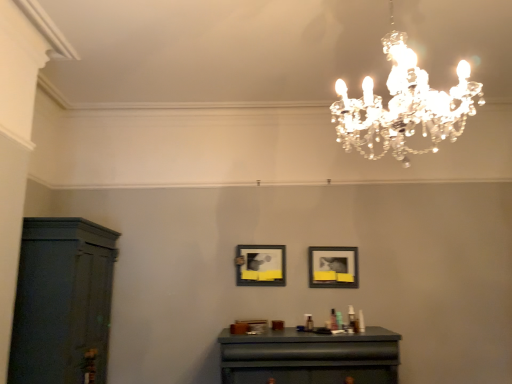
What do you see at coordinates (310, 357) in the screenshot? I see `matte black table at center` at bounding box center [310, 357].

Image resolution: width=512 pixels, height=384 pixels. Describe the element at coordinates (333, 267) in the screenshot. I see `matte black picture frame at center, which is counted as the second picture frame, starting from the left` at that location.

This screenshot has height=384, width=512. Describe the element at coordinates (403, 107) in the screenshot. I see `clear crystal chandelier at upper center` at that location.

What do you see at coordinates (261, 265) in the screenshot? I see `matte black picture frame at center, the 2th picture frame in the right-to-left sequence` at bounding box center [261, 265].

The height and width of the screenshot is (384, 512). What are the coordinates of `dark wood cabinet at left` in the screenshot? It's located at (62, 302).

Which object is further away from the camera taking this photo, matte black picture frame at center, the 2th picture frame in the right-to-left sequence, or clear crystal chandelier at upper center?

Positioned behind is matte black picture frame at center, the 2th picture frame in the right-to-left sequence.

Can you confirm if matte black picture frame at center, the 2th picture frame in the right-to-left sequence, is taller than clear crystal chandelier at upper center?

In fact, matte black picture frame at center, the 2th picture frame in the right-to-left sequence, may be shorter than clear crystal chandelier at upper center.

Which is farther from the camera, (240, 282) or (374, 156)?

Positioned behind is point (374, 156).

From the image's perspective, is matte black picture frame at center, the 2th picture frame in the right-to-left sequence, located above clear crystal chandelier at upper center?

No.

From a real-world perspective, which is physically below, clear crystal chandelier at upper center or matte black picture frame at center, the 2th picture frame in the right-to-left sequence?

In real-world perspective, matte black picture frame at center, the 2th picture frame in the right-to-left sequence, is lower.

Where is `picture frame that is the 1st one below the clear crystal chandelier at upper center (from a real-world perspective)`? Image resolution: width=512 pixels, height=384 pixels. picture frame that is the 1st one below the clear crystal chandelier at upper center (from a real-world perspective) is located at coordinates (261, 265).

Is point (395, 154) farther from camera compared to point (266, 248)?

Yes, point (395, 154) is farther from viewer.

In the image, is clear crystal chandelier at upper center on the left side or the right side of matte black picture frame at center, the 2th picture frame in the right-to-left sequence?

clear crystal chandelier at upper center is positioned on matte black picture frame at center, the 2th picture frame in the right-to-left sequence,'s right side.

Between point (252, 270) and point (331, 275), which one is positioned behind?

Positioned behind is point (252, 270).

Is matte black picture frame at center, the 2th picture frame in the right-to-left sequence, not inside matte black picture frame at center, the 1th picture frame viewed from the right?

Yes.

Is matte black picture frame at center, the 2th picture frame in the right-to-left sequence, facing towards matte black picture frame at center, which is counted as the second picture frame, starting from the left?

No.

Looking at this image, does matte black picture frame at center, the 2th picture frame in the right-to-left sequence, appear on the left side of matte black picture frame at center, which is counted as the second picture frame, starting from the left?

Yes.

From the picture: Which object is positioned more to the left, dark wood cabinet at left or matte black table at center?

From the viewer's perspective, dark wood cabinet at left appears more on the left side.

Is dark wood cabinet at left wider than matte black table at center?

Indeed, dark wood cabinet at left has a greater width compared to matte black table at center.

Is dark wood cabinet at left situated inside matte black table at center or outside?

dark wood cabinet at left is not enclosed by matte black table at center.

Is clear crystal chandelier at upper center further to camera compared to matte black picture frame at center, which is counted as the second picture frame, starting from the left?

No, it is not.

What are the coordinates of `the 2nd picture frame below the clear crystal chandelier at upper center (from the image's perspective)` in the screenshot? It's located at (333, 267).

Considering the sizes of clear crystal chandelier at upper center and matte black picture frame at center, the 1th picture frame viewed from the right, in the image, is clear crystal chandelier at upper center bigger or smaller than matte black picture frame at center, the 1th picture frame viewed from the right,?

Considering their sizes, clear crystal chandelier at upper center takes up more space than matte black picture frame at center, the 1th picture frame viewed from the right.

Does matte black table at center have a greater height compared to matte black picture frame at center, the 1th picture frame viewed from the right?

Yes, matte black table at center is taller than matte black picture frame at center, the 1th picture frame viewed from the right.

Can matte black picture frame at center, the 1th picture frame viewed from the right, be found inside matte black table at center?

No, matte black picture frame at center, the 1th picture frame viewed from the right, is located outside of matte black table at center.

Considering their positions, is matte black table at center located in front of or behind matte black picture frame at center, the 1th picture frame viewed from the right?

Clearly, matte black table at center is in front of matte black picture frame at center, the 1th picture frame viewed from the right.

Is matte black picture frame at center, which is counted as the second picture frame, starting from the left, positioned with its back to matte black table at center?

No, matte black picture frame at center, which is counted as the second picture frame, starting from the left, is not facing away from matte black table at center.

Is matte black picture frame at center, the 1th picture frame viewed from the right, inside the boundaries of matte black table at center, or outside?

matte black picture frame at center, the 1th picture frame viewed from the right, exists outside the volume of matte black table at center.

Considering the sizes of objects matte black picture frame at center, which is counted as the second picture frame, starting from the left, and matte black table at center in the image provided, who is wider, matte black picture frame at center, which is counted as the second picture frame, starting from the left, or matte black table at center?

With larger width is matte black table at center.

Which of these two, matte black picture frame at center, the 1th picture frame viewed from the right, or matte black table at center, stands taller?

With more height is matte black table at center.

Where is `lamp that is above the matte black picture frame at center, the 2th picture frame in the right-to-left sequence (from a real-world perspective)`? The image size is (512, 384). lamp that is above the matte black picture frame at center, the 2th picture frame in the right-to-left sequence (from a real-world perspective) is located at coordinates (403, 107).

Locate an element on the screen. lamp on the right of matte black picture frame at center, the 2th picture frame in the right-to-left sequence is located at coordinates (403, 107).

Which object lies nearer to the anchor point matte black table at center, clear crystal chandelier at upper center or dark wood cabinet at left?

Among the two, dark wood cabinet at left is located nearer to matte black table at center.

Which object lies nearer to the anchor point clear crystal chandelier at upper center, matte black picture frame at center, placed as the first picture frame when sorted from left to right, or matte black picture frame at center, the 1th picture frame viewed from the right?

matte black picture frame at center, the 1th picture frame viewed from the right, lies closer to clear crystal chandelier at upper center than the other object.

In the scene shown: From the image, which object appears to be farther from clear crystal chandelier at upper center, matte black table at center or matte black picture frame at center, the 2th picture frame in the right-to-left sequence?

Among the two, matte black picture frame at center, the 2th picture frame in the right-to-left sequence, is located further to clear crystal chandelier at upper center.

Considering their positions, is clear crystal chandelier at upper center positioned further to dark wood cabinet at left than matte black table at center?

clear crystal chandelier at upper center is positioned further to the anchor dark wood cabinet at left.

Estimate the real-world distances between objects in this image. Which object is further from matte black table at center, clear crystal chandelier at upper center or matte black picture frame at center, placed as the first picture frame when sorted from left to right?

Among the two, clear crystal chandelier at upper center is located further to matte black table at center.

Looking at the image, which one is located further to dark wood cabinet at left, matte black picture frame at center, placed as the first picture frame when sorted from left to right, or matte black table at center?

matte black picture frame at center, placed as the first picture frame when sorted from left to right, is positioned further to the anchor dark wood cabinet at left.

Consider the image. Based on their spatial positions, is matte black table at center or dark wood cabinet at left further from clear crystal chandelier at upper center?

Among the two, dark wood cabinet at left is located further to clear crystal chandelier at upper center.

Which object lies nearer to the anchor point matte black table at center, dark wood cabinet at left or matte black picture frame at center, the 2th picture frame in the right-to-left sequence?

matte black picture frame at center, the 2th picture frame in the right-to-left sequence, lies closer to matte black table at center than the other object.

Where is `table located between dark wood cabinet at left and matte black picture frame at center, the 1th picture frame viewed from the right, in the left-right direction`? Image resolution: width=512 pixels, height=384 pixels. table located between dark wood cabinet at left and matte black picture frame at center, the 1th picture frame viewed from the right, in the left-right direction is located at coordinates (310, 357).

I want to click on lamp located between dark wood cabinet at left and matte black picture frame at center, the 1th picture frame viewed from the right, in the left-right direction, so click(x=403, y=107).

At what (x,y) coordinates should I click in order to perform the action: click on picture frame between dark wood cabinet at left and matte black picture frame at center, which is counted as the second picture frame, starting from the left, in the horizontal direction. Please return your answer as a coordinate pair (x, y). Looking at the image, I should click on (261, 265).

Locate an element on the screen. picture frame between dark wood cabinet at left and matte black table at center from left to right is located at coordinates (261, 265).